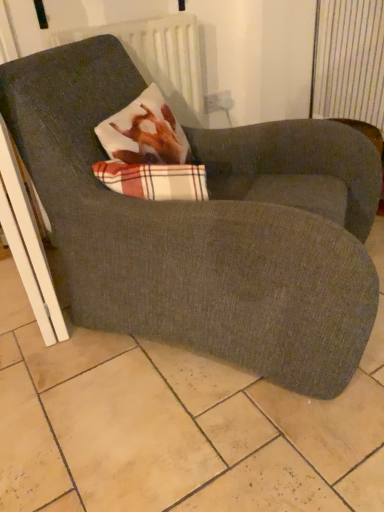
Question: In terms of width, does white textured radiator at upper center look wider or thinner when compared to dark gray fabric chair at center?

Choices:
 (A) thin
 (B) wide

Answer: (A)

Question: Is white textured radiator at upper center bigger or smaller than dark gray fabric chair at center?

Choices:
 (A) small
 (B) big

Answer: (A)

Question: From the image's perspective, is white textured radiator at upper center located above or below dark gray fabric chair at center?

Choices:
 (A) above
 (B) below

Answer: (A)

Question: In terms of height, does dark gray fabric chair at center look taller or shorter compared to white textured radiator at upper center?

Choices:
 (A) tall
 (B) short

Answer: (A)

Question: Is dark gray fabric chair at center spatially inside white textured radiator at upper center, or outside of it?

Choices:
 (A) inside
 (B) outside

Answer: (B)

Question: From a real-world perspective, is dark gray fabric chair at center positioned above or below white textured radiator at upper center?

Choices:
 (A) above
 (B) below

Answer: (B)

Question: Visually, is dark gray fabric chair at center positioned to the left or to the right of white textured radiator at upper center?

Choices:
 (A) left
 (B) right

Answer: (B)